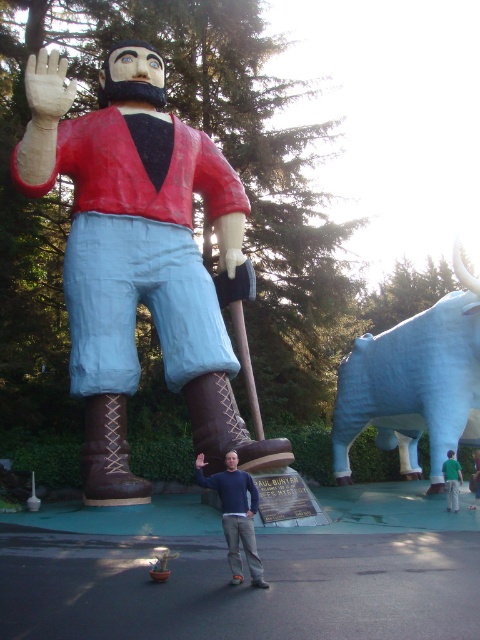
You are an artist planning to paint a mural inspired by the sculpture of Paul Bunyan. You need to ensure the proportions of the brown woven fabric pole at center and the green fabric shirt at lower right are accurate. Which object should be depicted as taller in your mural?

The brown woven fabric pole at center should be depicted as taller in the mural since it has a greater height compared to the green fabric shirt at lower right according to the description.

You are standing in front of the Paul Bunyan sculpture and want to take a photo. You notice two points on the sculpture marked at coordinates point (444, 365) and point (194, 474). Which point will appear closer to the camera in your photo?

Point (444, 365) is closer to the camera than point (194, 474), so it will appear closer in the photo.